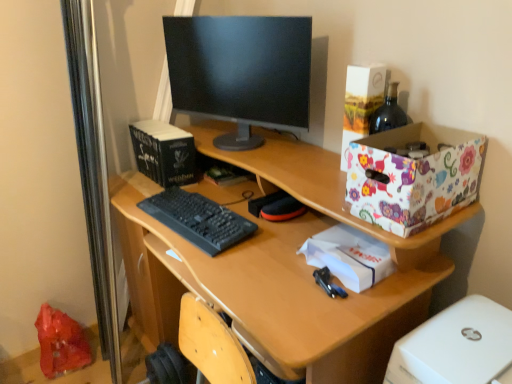
What do you see at coordinates (349, 256) in the screenshot?
I see `white paper at center` at bounding box center [349, 256].

What is the approximate height of wooden desk at center?

wooden desk at center is 34.22 inches tall.

Measure the distance between floral-patterned cardboard box at upper right and camera.

The depth of floral-patterned cardboard box at upper right is 36.17 inches.

Locate an element on the screen. The image size is (512, 384). white paper at center is located at coordinates (349, 256).

Does wooden desk at center contain hardcover book at center, placed as the first book when sorted from right to left?

Yes, hardcover book at center, placed as the first book when sorted from right to left, is surrounded by wooden desk at center.

Is wooden desk at center directly adjacent to hardcover book at center, placed as the first book when sorted from right to left?

No.

Can you tell me how much wooden desk at center and hardcover book at center, placed as the first book when sorted from right to left, differ in facing direction?

The facing directions of wooden desk at center and hardcover book at center, placed as the first book when sorted from right to left, are 0.795 degrees apart.

In order to click on the 2nd book behind the wooden desk at center, counting from the anchor's position in this screenshot , I will do `click(226, 174)`.

Which is more to the left, shiny plastic bag at lower left or wooden desk at center?

A: shiny plastic bag at lower left.

Who is shorter, shiny plastic bag at lower left or wooden desk at center?

shiny plastic bag at lower left.

In the scene shown: Is shiny plastic bag at lower left located outside wooden desk at center?

Absolutely, shiny plastic bag at lower left is external to wooden desk at center.

In terms of size, does shiny plastic bag at lower left appear bigger or smaller than wooden desk at center?

shiny plastic bag at lower left is smaller than wooden desk at center.

The width and height of the screenshot is (512, 384). I want to click on storage box in front of the floral paper box at upper right, so point(414,177).

From a real-world perspective, which object stands above the other?

floral paper box at upper right.

Is floral paper box at upper right far away from floral-patterned cardboard box at upper right?

No, floral paper box at upper right is in close proximity to floral-patterned cardboard box at upper right.

Is point (345, 98) behind point (431, 175)?

Yes, point (345, 98) is behind point (431, 175).

Which object is positioned more to the right, wooden desk at center or shiny plastic bag at lower left?

wooden desk at center is more to the right.

From a real-world perspective, which object stands above the other?

A: From a 3D spatial view, wooden desk at center is above.

Is wooden desk at center oriented away from shiny plastic bag at lower left?

No, shiny plastic bag at lower left is not at the back of wooden desk at center.

What's the angular difference between wooden desk at center and shiny plastic bag at lower left's facing directions?

The angle between the facing direction of wooden desk at center and the facing direction of shiny plastic bag at lower left is 89.2 degrees.

Is floral paper box at upper right situated inside wooden desk at center or outside?

floral paper box at upper right exists outside the volume of wooden desk at center.

Can you confirm if floral paper box at upper right is thinner than wooden desk at center?

Yes.

At what (x,y) coordinates should I click in order to perform the action: click on desk that appears below the floral paper box at upper right (from the image's perspective). Please return your answer as a coordinate pair (x, y). Image resolution: width=512 pixels, height=384 pixels. Looking at the image, I should click on (286, 270).

Does floral paper box at upper right come behind wooden desk at center?

Yes, it is.

From a real-world perspective, is hardcover book at center, arranged as the second book when viewed from the left, beneath floral-patterned cardboard box at upper right?

Indeed, from a real-world perspective, hardcover book at center, arranged as the second book when viewed from the left, is positioned beneath floral-patterned cardboard box at upper right.

Is hardcover book at center, arranged as the second book when viewed from the left, positioned far away from floral-patterned cardboard box at upper right?

No, hardcover book at center, arranged as the second book when viewed from the left, is in close proximity to floral-patterned cardboard box at upper right.

Which is more to the right, hardcover book at center, placed as the first book when sorted from right to left, or floral-patterned cardboard box at upper right?

Positioned to the right is floral-patterned cardboard box at upper right.

Is hardcover book at center, arranged as the second book when viewed from the left, oriented away from floral-patterned cardboard box at upper right?

No, hardcover book at center, arranged as the second book when viewed from the left, is not facing the opposite direction of floral-patterned cardboard box at upper right.

Is floral paper box at upper right oriented away from hardcover book at center, arranged as the second book when viewed from the left?

floral paper box at upper right is not turned away from hardcover book at center, arranged as the second book when viewed from the left.

Between floral paper box at upper right and hardcover book at center, arranged as the second book when viewed from the left, which one has less height?

hardcover book at center, arranged as the second book when viewed from the left.

From the image's perspective, is floral paper box at upper right over hardcover book at center, arranged as the second book when viewed from the left?

Yes, from the image's perspective, floral paper box at upper right is on top of hardcover book at center, arranged as the second book when viewed from the left.

Is floral paper box at upper right in contact with hardcover book at center, placed as the first book when sorted from right to left?

floral paper box at upper right is not next to hardcover book at center, placed as the first book when sorted from right to left, and they're not touching.

From a real-world perspective, count 1st books upward from the wooden desk at center and point to it. Please provide its 2D coordinates.

[(226, 174)]

I want to click on desk that appears above the shiny plastic bag at lower left (from the image's perspective), so click(x=286, y=270).

When comparing their distances from black matte keyboard at center, does shiny plastic bag at lower left or white paper at center seem further?

shiny plastic bag at lower left lies further to black matte keyboard at center than the other object.

Which object lies further to the anchor point wooden desk at center, floral paper box at upper right or black glossy monitor at center?

Based on the image, floral paper box at upper right appears to be further to wooden desk at center.

From the image, which object appears to be farther from black matte book at upper left, placed as the 1th book when sorted from left to right, wooden desk at center or black glossy monitor at center?

wooden desk at center is positioned further to the anchor black matte book at upper left, placed as the 1th book when sorted from left to right.

Considering their positions, is black matte book at upper left, placed as the 1th book when sorted from left to right, positioned further to black matte keyboard at center than wooden desk at center?

Among the two, black matte book at upper left, placed as the 1th book when sorted from left to right, is located further to black matte keyboard at center.

From the image, which object appears to be nearer to black matte book at upper left, placed as the 1th book when sorted from left to right, floral-patterned cardboard box at upper right or black matte keyboard at center?

Based on the image, black matte keyboard at center appears to be nearer to black matte book at upper left, placed as the 1th book when sorted from left to right.

When comparing their distances from hardcover book at center, arranged as the second book when viewed from the left, does floral paper box at upper right or wooden desk at center seem closer?

The object closer to hardcover book at center, arranged as the second book when viewed from the left, is wooden desk at center.

Based on the photo, looking at the image, which one is located further to floral-patterned cardboard box at upper right, wooden desk at center or white paper at center?

Among the two, wooden desk at center is located further to floral-patterned cardboard box at upper right.

Looking at the image, which one is located further to floral-patterned cardboard box at upper right, hardcover book at center, arranged as the second book when viewed from the left, or white paper at center?

hardcover book at center, arranged as the second book when viewed from the left, is positioned further to the anchor floral-patterned cardboard box at upper right.

At what (x,y) coordinates should I click in order to perform the action: click on package between black matte book at upper left, the 2th book viewed from the right, and floral paper box at upper right from left to right. Please return your answer as a coordinate pair (x, y). Looking at the image, I should click on (349, 256).

I want to click on computer keyboard between black matte book at upper left, placed as the 1th book when sorted from left to right, and shiny plastic bag at lower left vertically, so click(x=198, y=219).

At what (x,y) coordinates should I click in order to perform the action: click on desk located between black matte keyboard at center and floral paper box at upper right in the left-right direction. Please return your answer as a coordinate pair (x, y). Looking at the image, I should click on (286, 270).

The image size is (512, 384). Find the location of `shopping bag between wooden desk at center and hardcover book at center, placed as the first book when sorted from right to left, along the z-axis`. shopping bag between wooden desk at center and hardcover book at center, placed as the first book when sorted from right to left, along the z-axis is located at coordinates (60, 343).